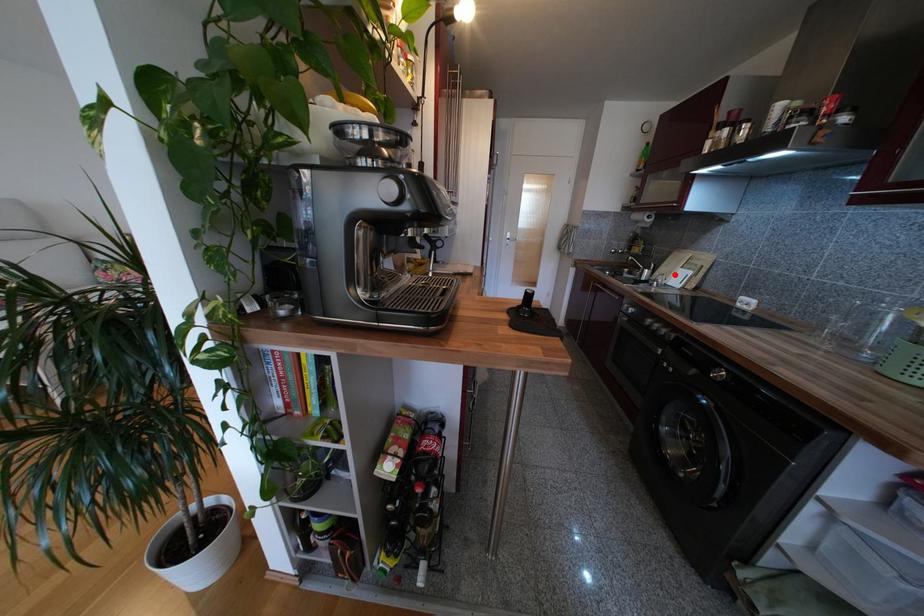
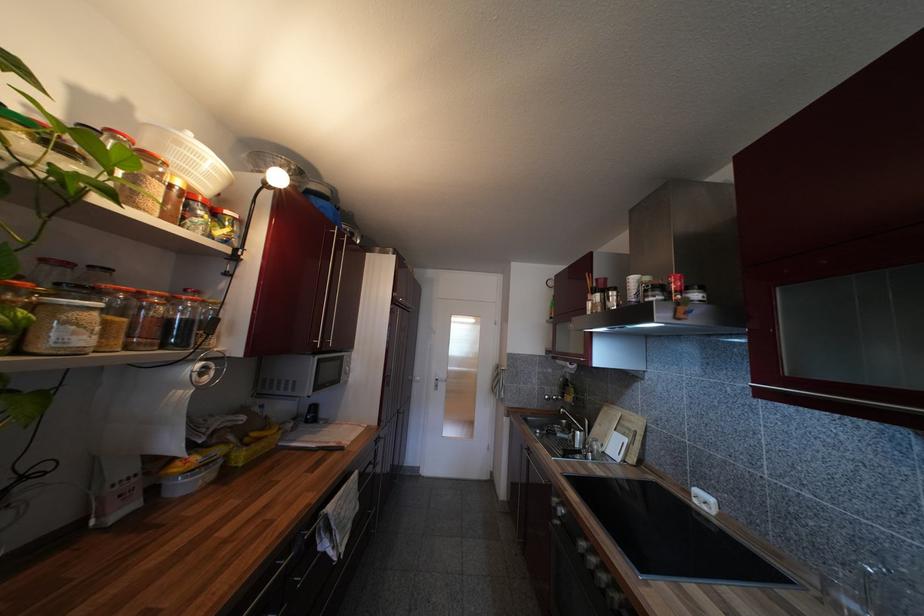
The point at the highlighted location is marked in the first image. Where is the corresponding point in the second image?

(610, 438)